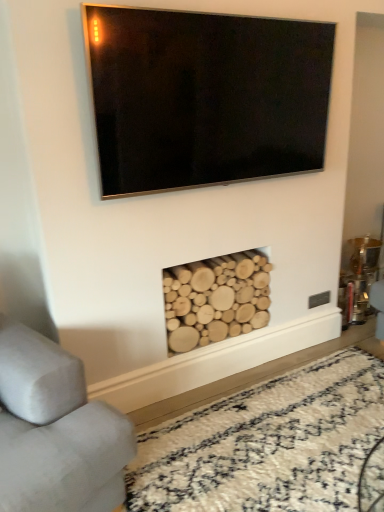
Locate an element on the screen. This screenshot has width=384, height=512. vacant point above matte black tv at upper center (from a real-world perspective) is located at coordinates (236, 14).